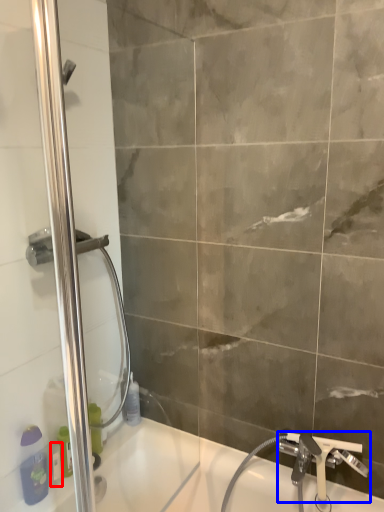
Question: Which object appears closest to the camera in this image, toiletry (highlighted by a red box) or tap (highlighted by a blue box)?

Choices:
 (A) toiletry
 (B) tap

Answer: (B)